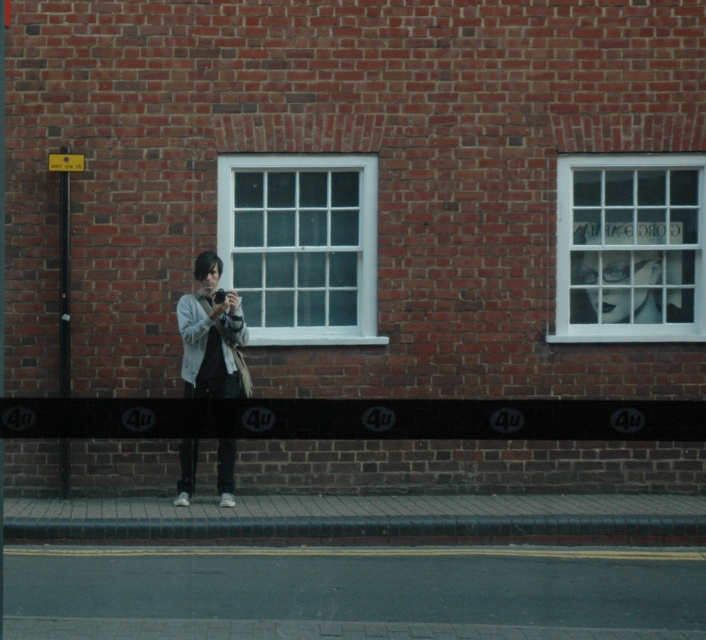
Consider the image. Which of these two, white glass window at center or matte gray jacket at center, stands taller?

Standing taller between the two is white glass window at center.

Measure the distance between white glass window at center and matte gray jacket at center.

white glass window at center is 28.03 inches away from matte gray jacket at center.

What do you see at coordinates (299, 244) in the screenshot?
I see `white glass window at center` at bounding box center [299, 244].

The image size is (706, 640). What are the coordinates of `white glass window at center` in the screenshot? It's located at (299, 244).

Does white glass window at upper right appear on the left side of smooth concrete curb at lower center?

In fact, white glass window at upper right is to the right of smooth concrete curb at lower center.

I want to click on white glass window at upper right, so click(x=630, y=248).

Where is `white glass window at upper right`? white glass window at upper right is located at coordinates pyautogui.click(x=630, y=248).

Find the location of a particular element. The height and width of the screenshot is (640, 706). white glass window at upper right is located at coordinates (630, 248).

Can you confirm if smooth concrete curb at lower center is thinner than matte gray jacket at center?

In fact, smooth concrete curb at lower center might be wider than matte gray jacket at center.

Is smooth concrete curb at lower center further to camera compared to matte gray jacket at center?

No.

Which is in front, point (347, 522) or point (213, 310)?

Point (347, 522) is in front.

Image resolution: width=706 pixels, height=640 pixels. What are the coordinates of `smooth concrete curb at lower center` in the screenshot? It's located at (361, 529).